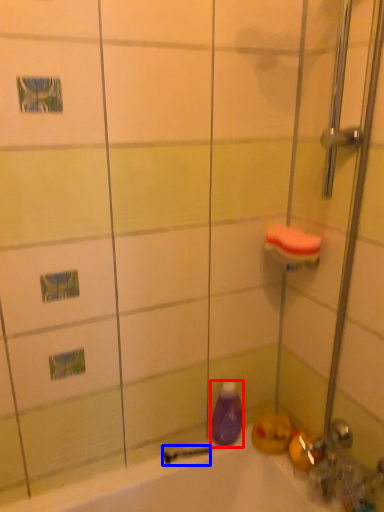
Question: Among these objects, which one is farthest to the camera, cleaning product (highlighted by a red box) or shower (highlighted by a blue box)?

Choices:
 (A) cleaning product
 (B) shower

Answer: (B)